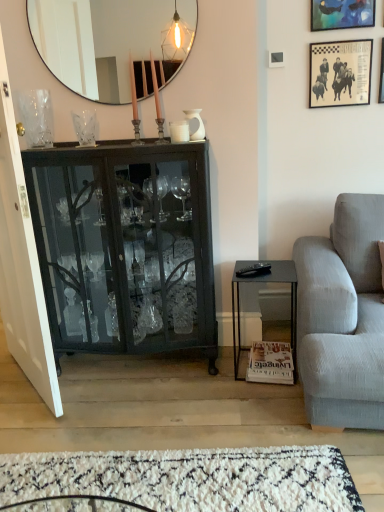
I want to click on free space in front of white matte door at left, so click(x=31, y=420).